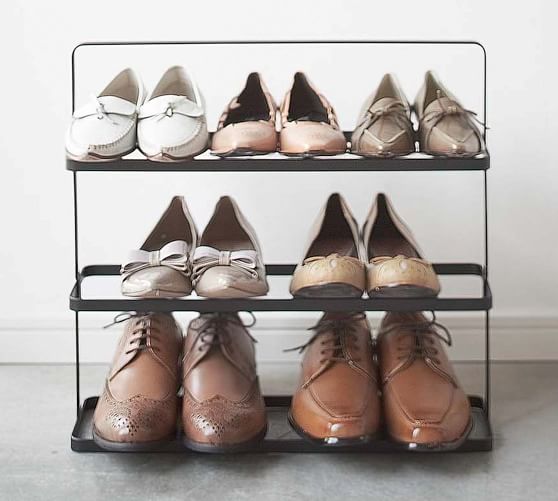
Where is `the top shelf shoe`? the top shelf shoe is located at coordinates (102, 135), (165, 137), (239, 139), (321, 143), (365, 143), (445, 140).